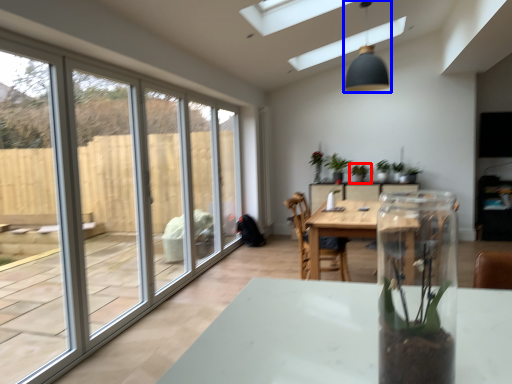
Question: Which point is further to the camera, houseplant (highlighted by a red box) or light fixture (highlighted by a blue box)?

Choices:
 (A) houseplant
 (B) light fixture

Answer: (A)